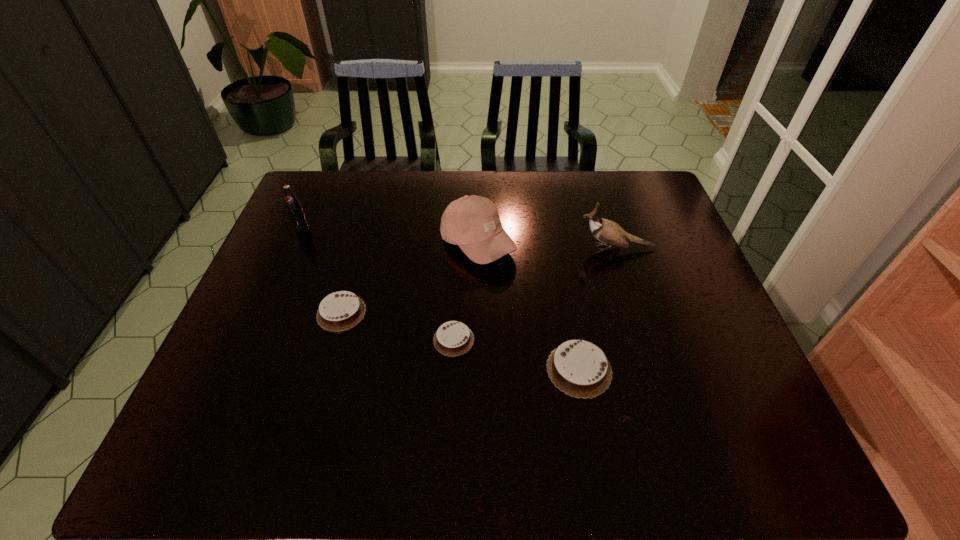
Image resolution: width=960 pixels, height=540 pixels. Identify the location of vacant space at the far edge of the desktop. (588, 174).

The width and height of the screenshot is (960, 540). In the image, there is a desktop. Identify the location of vacant space at the near edge. (300, 383).

Locate an element on the screen. The image size is (960, 540). vacant space at the left edge of the desktop is located at coordinates (276, 279).

Locate an element on the screen. The height and width of the screenshot is (540, 960). free spot at the right edge of the desktop is located at coordinates (707, 293).

The width and height of the screenshot is (960, 540). I want to click on free spot at the far right corner of the desktop, so click(640, 187).

Locate an element on the screen. empty space that is in between the bird and the leftmost chocolate cake is located at coordinates (479, 280).

Locate an element on the screen. free space between the second object from left to right and the shortest chocolate cake is located at coordinates (397, 326).

Find the location of a particular element. The width and height of the screenshot is (960, 540). blank region between the shortest object and the baseball cap is located at coordinates (466, 292).

Find the location of a particular element. vacant space that is in between the leftmost object and the second shortest object is located at coordinates (322, 270).

You are a GUI agent. You are given a task and a screenshot of the screen. Output one action in this format:
    pyautogui.click(x=<x>, y=<y>)
    Task: Click on the free area in between the second chocolate cake from left to right and the tallest chocolate cake
    
    Given the screenshot: What is the action you would take?
    pyautogui.click(x=516, y=354)